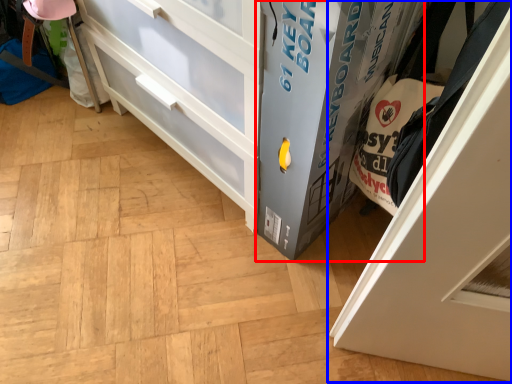
Question: Which object appears farthest to the camera in this image, cabinetry (highlighted by a red box) or door (highlighted by a blue box)?

Choices:
 (A) cabinetry
 (B) door

Answer: (A)